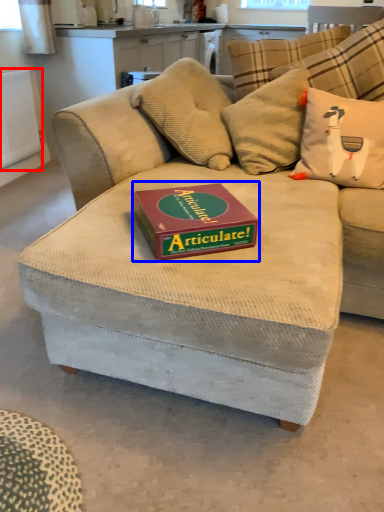
Question: Which object is closer to the camera taking this photo, radiator (highlighted by a red box) or paperback book (highlighted by a blue box)?

Choices:
 (A) radiator
 (B) paperback book

Answer: (B)